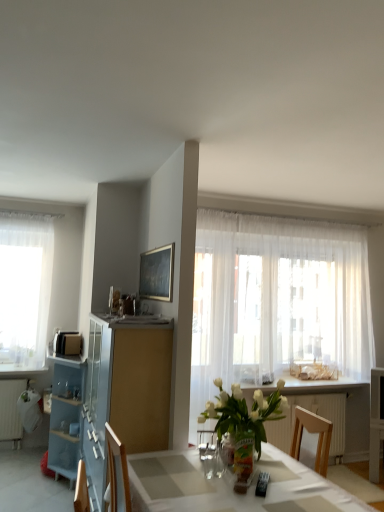
Question: Is blue glass cabinet at left positioned before white glass vase at center?

Choices:
 (A) no
 (B) yes

Answer: (A)

Question: Is blue glass cabinet at left surrounding white glass vase at center?

Choices:
 (A) yes
 (B) no

Answer: (B)

Question: Is blue glass cabinet at left next to white glass vase at center?

Choices:
 (A) yes
 (B) no

Answer: (B)

Question: Does blue glass cabinet at left lie behind white glass vase at center?

Choices:
 (A) yes
 (B) no

Answer: (A)

Question: From a real-world perspective, is blue glass cabinet at left under white glass vase at center?

Choices:
 (A) no
 (B) yes

Answer: (B)

Question: Is blue glass cabinet at left bigger than white glass vase at center?

Choices:
 (A) yes
 (B) no

Answer: (A)

Question: From the image's perspective, is white glossy counter top at center beneath white matte radiator at lower left, marked as the first radiator in a left-to-right arrangement?

Choices:
 (A) yes
 (B) no

Answer: (B)

Question: Is white glossy counter top at center wider than white matte radiator at lower left, marked as the first radiator in a left-to-right arrangement?

Choices:
 (A) yes
 (B) no

Answer: (A)

Question: Is white glossy counter top at center not inside white matte radiator at lower left, which appears as the second radiator when viewed from the right?

Choices:
 (A) yes
 (B) no

Answer: (A)

Question: Is white matte radiator at lower left, marked as the first radiator in a left-to-right arrangement, located within white glossy counter top at center?

Choices:
 (A) yes
 (B) no

Answer: (B)

Question: Would you say white glossy counter top at center is a long distance from white matte radiator at lower left, marked as the first radiator in a left-to-right arrangement?

Choices:
 (A) yes
 (B) no

Answer: (A)

Question: From a real-world perspective, is white glossy counter top at center beneath white matte radiator at lower left, which appears as the second radiator when viewed from the right?

Choices:
 (A) no
 (B) yes

Answer: (A)

Question: From the image's perspective, is sheer white curtain at right, the first curtain positioned from the right, under white glossy counter top at center?

Choices:
 (A) yes
 (B) no

Answer: (B)